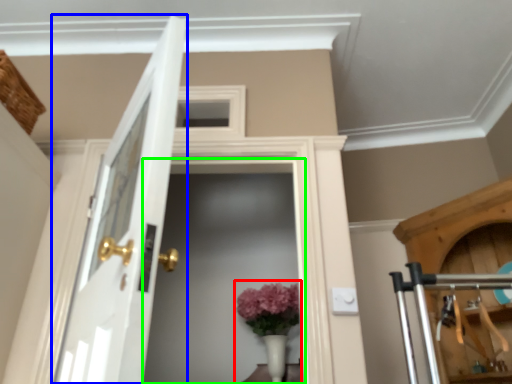
Question: Which is farther away from floral arrangement (highlighted by a red box)? door (highlighted by a blue box) or screen door (highlighted by a green box)?

Choices:
 (A) door
 (B) screen door

Answer: (A)